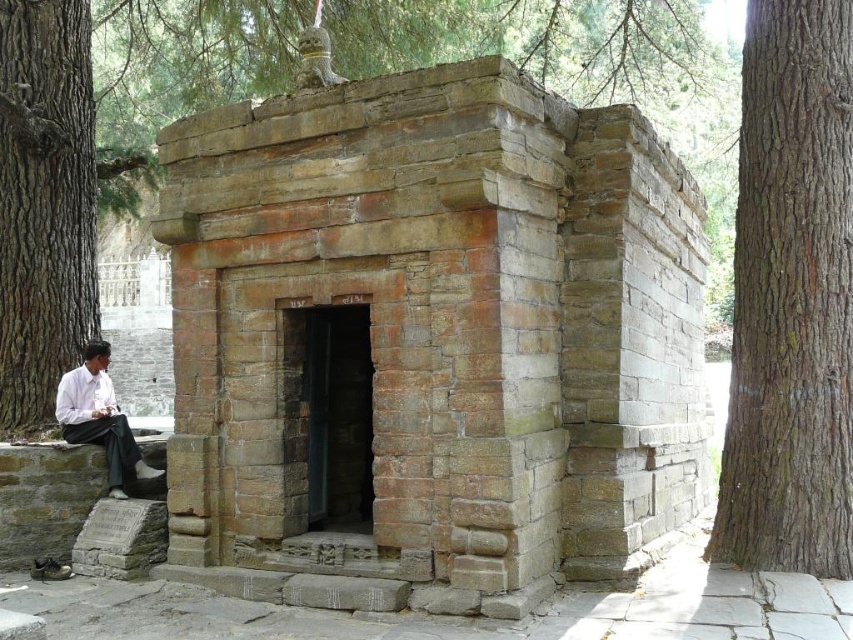
You are standing in a forest and see the rustic stone hut at center and the white shirt at lower left. Which object is located to the right of the other?

The rustic stone hut at center is positioned on the right side of white shirt at lower left.

You are standing in front of the rustic stone hut at center and the brown rough bark tree at right. Which one is taller?

The rustic stone hut at center is shorter than the brown rough bark tree at right, so the brown rough bark tree at right is taller.

You are standing at the point marked by coordinates (x=430, y=342) in the image of the stone structure. Which object are you currently positioned on?

You are positioned on the rustic stone hut at center, as the point (x=430, y=342) is located on it.